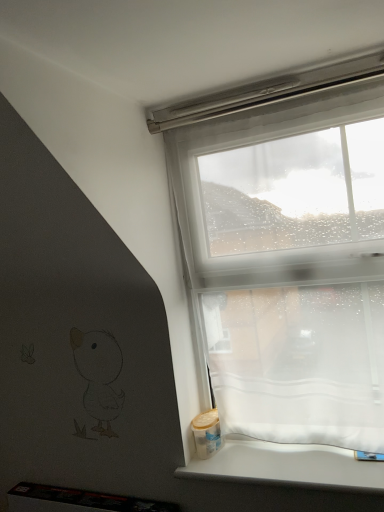
I want to click on free space below transparent fabric at upper right (from a real-world perspective), so click(290, 448).